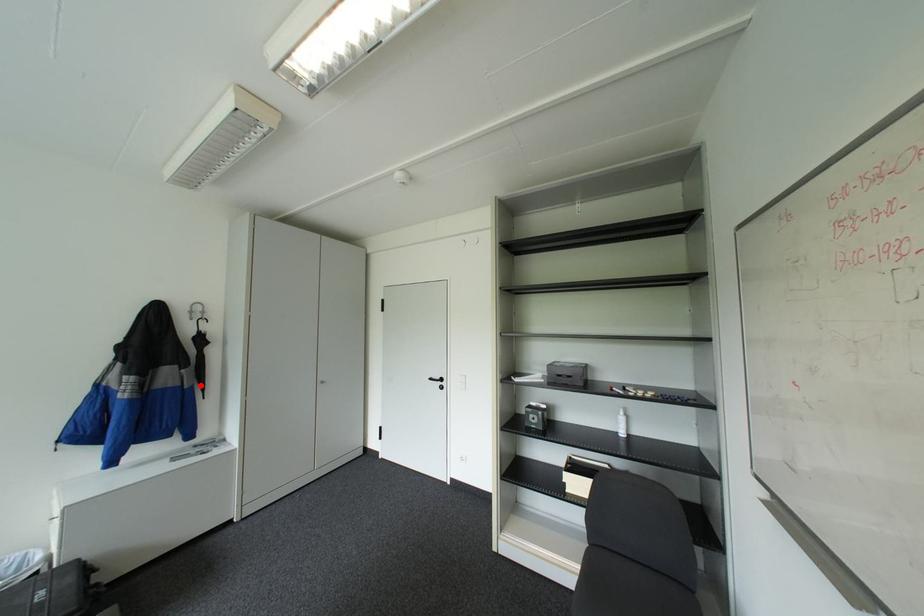
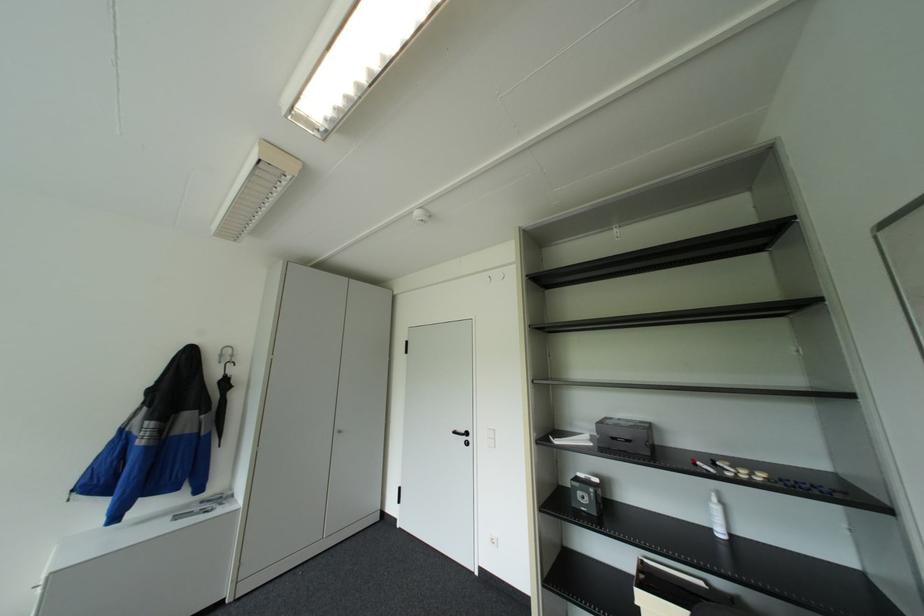
The point at the highlighted location is marked in the first image. Where is the corresponding point in the second image?

(217, 432)